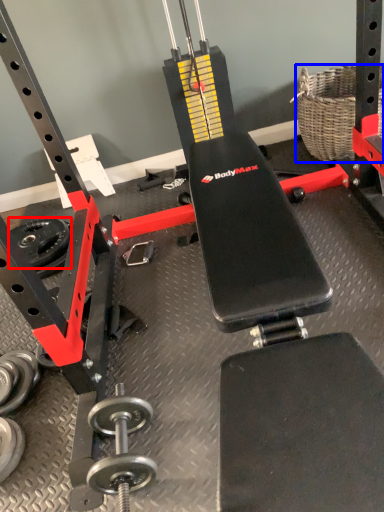
Question: Which object appears farthest to the camera in this image, wheel (highlighted by a red box) or basket (highlighted by a blue box)?

Choices:
 (A) wheel
 (B) basket

Answer: (A)